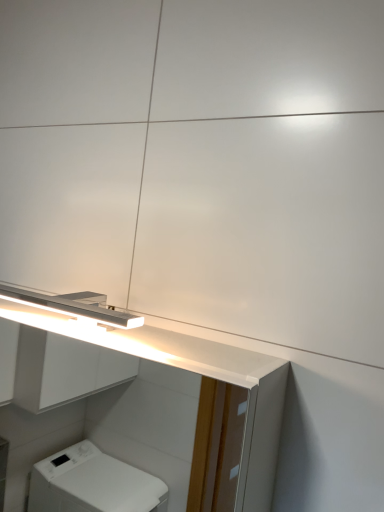
Question: From a real-world perspective, is satin white cabinet at upper center physically below satin nickel light fixture at upper left?

Choices:
 (A) yes
 (B) no

Answer: (A)

Question: Can you confirm if satin white cabinet at upper center is wider than satin nickel light fixture at upper left?

Choices:
 (A) yes
 (B) no

Answer: (A)

Question: Is satin white cabinet at upper center in front of satin nickel light fixture at upper left?

Choices:
 (A) no
 (B) yes

Answer: (B)

Question: From a real-world perspective, is satin white cabinet at upper center over satin nickel light fixture at upper left?

Choices:
 (A) yes
 (B) no

Answer: (B)

Question: Would you say satin white cabinet at upper center contains satin nickel light fixture at upper left?

Choices:
 (A) no
 (B) yes

Answer: (B)

Question: Is satin white cabinet at upper center not near satin nickel light fixture at upper left?

Choices:
 (A) yes
 (B) no

Answer: (A)

Question: Does satin nickel light fixture at upper left lie in front of satin white cabinet at upper center?

Choices:
 (A) yes
 (B) no

Answer: (B)

Question: Is satin nickel light fixture at upper left completely or partially outside of satin white cabinet at upper center?

Choices:
 (A) no
 (B) yes

Answer: (A)

Question: From a real-world perspective, is satin nickel light fixture at upper left beneath satin white cabinet at upper center?

Choices:
 (A) no
 (B) yes

Answer: (A)

Question: From the image's perspective, is satin nickel light fixture at upper left beneath satin white cabinet at upper center?

Choices:
 (A) yes
 (B) no

Answer: (B)

Question: From the image's perspective, is satin nickel light fixture at upper left above satin white cabinet at upper center?

Choices:
 (A) no
 (B) yes

Answer: (B)

Question: Is satin nickel light fixture at upper left positioned far away from satin white cabinet at upper center?

Choices:
 (A) no
 (B) yes

Answer: (B)

Question: From the image's perspective, is satin white cabinet at upper center positioned above or below satin nickel light fixture at upper left?

Choices:
 (A) above
 (B) below

Answer: (B)